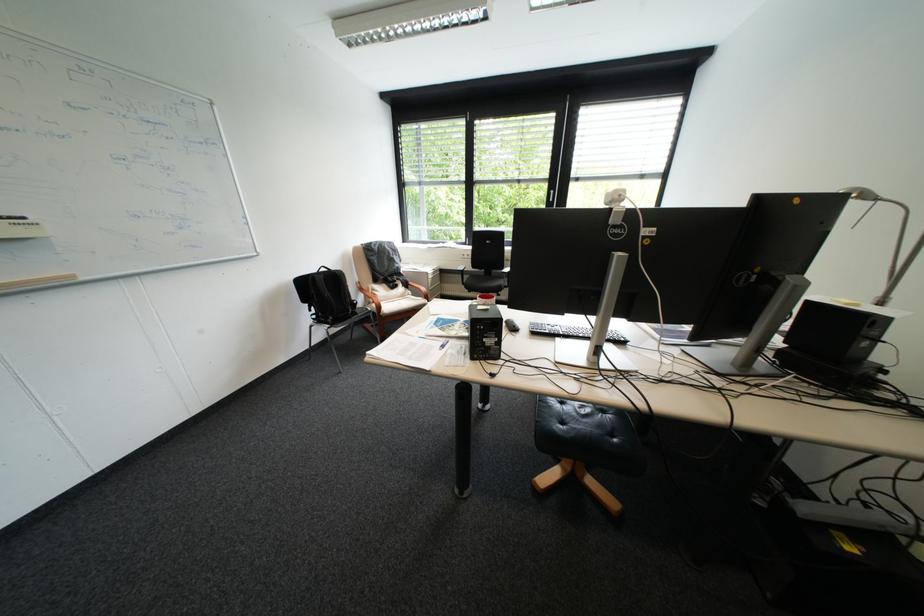
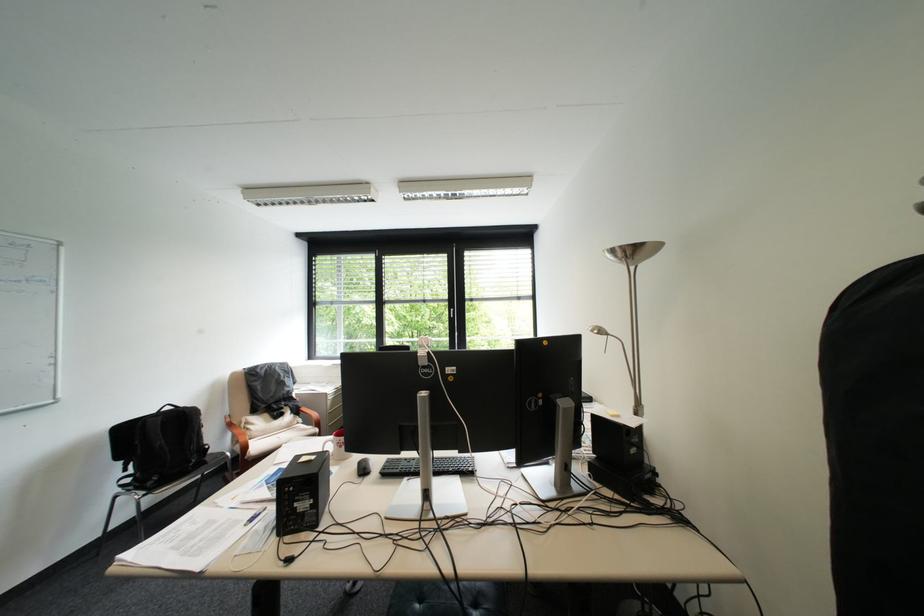
The point at (383, 291) is marked in the first image. Where is the corresponding point in the second image?

(256, 424)